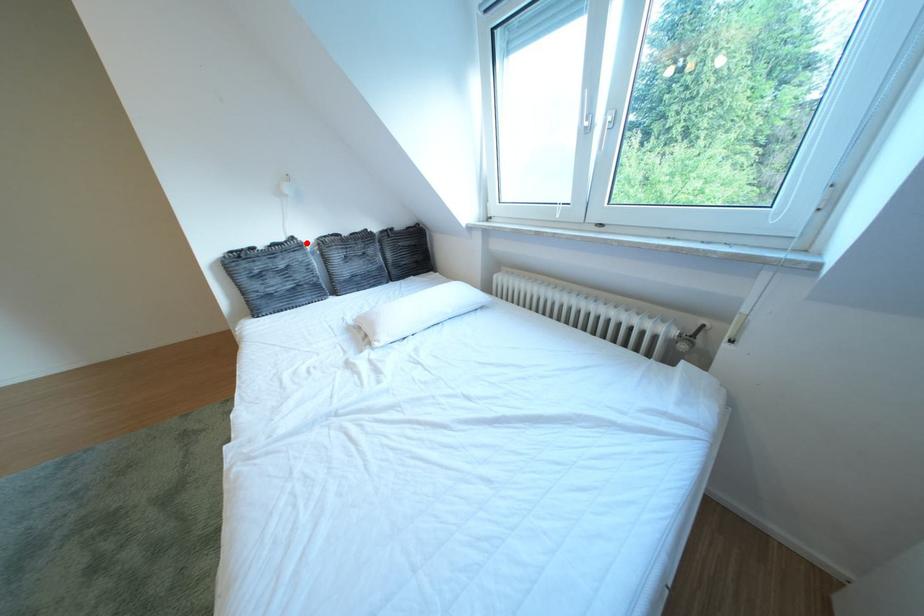
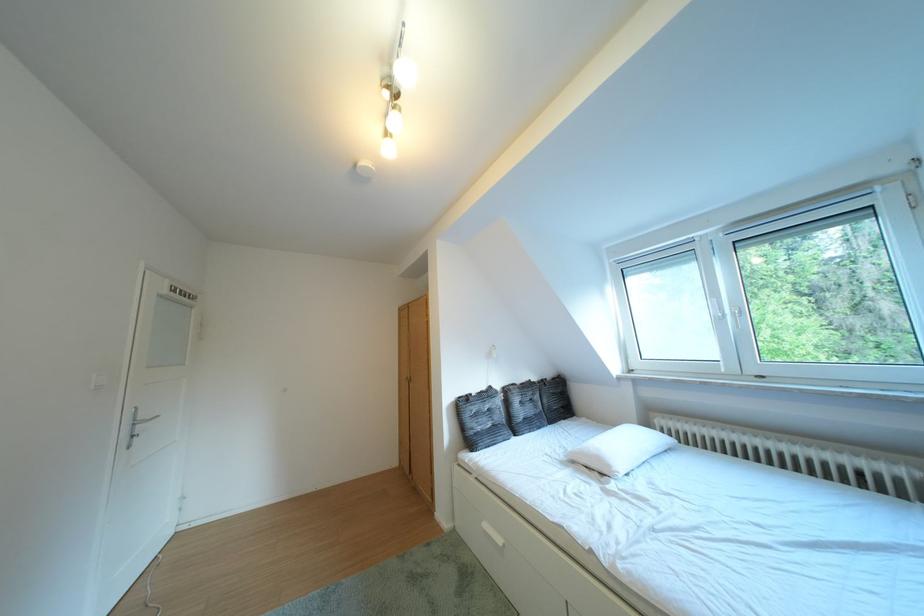
Locate, in the second image, the point that corresponds to the highlighted location in the first image.

(504, 392)